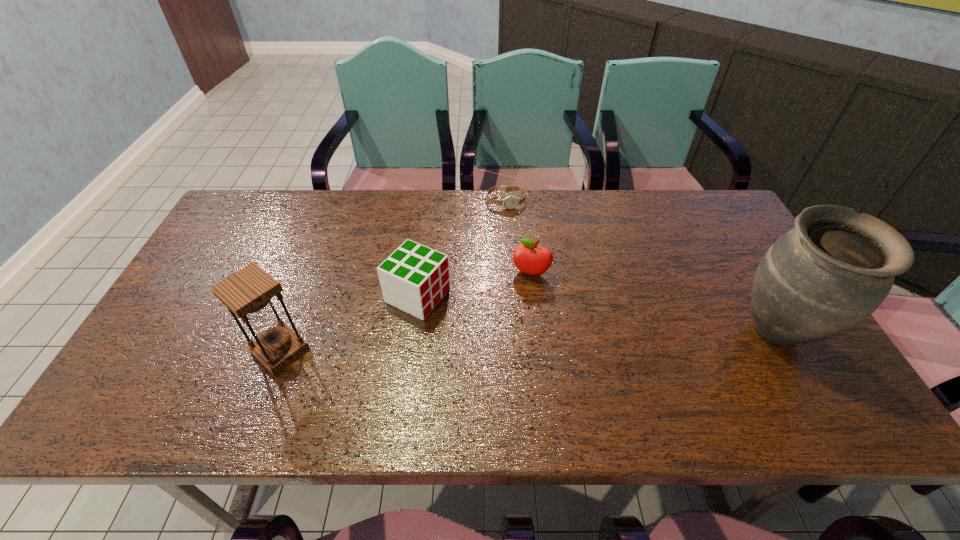
Locate which object ranks in proximity to the hourglass. Please provide its 2D coordinates. Your answer should be formatted as a tuple, i.e. [(x, y)], where the tuple contains the x and y coordinates of a point satisfying the conditions above.

[(414, 278)]

The image size is (960, 540). Identify the location of free space that satisfies the following two spatial constraints: 1. on the back side of the hourglass; 2. on the right side of the fourth object from right to left. (301, 295).

You are a GUI agent. You are given a task and a screenshot of the screen. Output one action in this format:
    pyautogui.click(x=<x>, y=<y>)
    Task: Click on the vacant space that satisfies the following two spatial constraints: 1. on the back side of the leftmost object; 2. on the left side of the cube
    
    Given the screenshot: What is the action you would take?
    pyautogui.click(x=301, y=295)

This screenshot has width=960, height=540. I want to click on blank space that satisfies the following two spatial constraints: 1. on the back side of the urn; 2. on the left side of the hourglass, so click(287, 332).